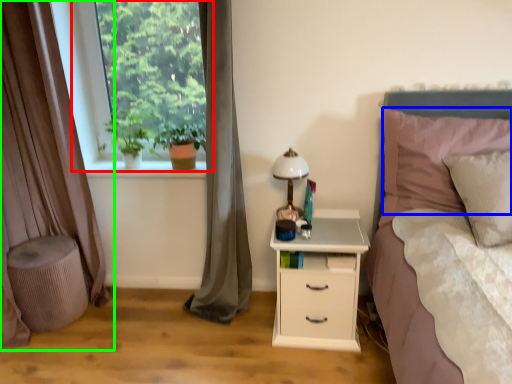
Question: Estimate the real-world distances between objects in this image. Which object is closer to window (highlighted by a red box), pillow (highlighted by a blue box) or curtain (highlighted by a green box)?

Choices:
 (A) pillow
 (B) curtain

Answer: (B)